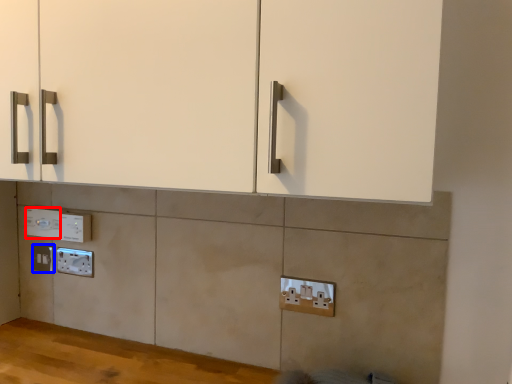
Question: Which of the following is the closest to the observer, electric outlet (highlighted by a red box) or electric outlet (highlighted by a blue box)?

Choices:
 (A) electric outlet
 (B) electric outlet

Answer: (A)